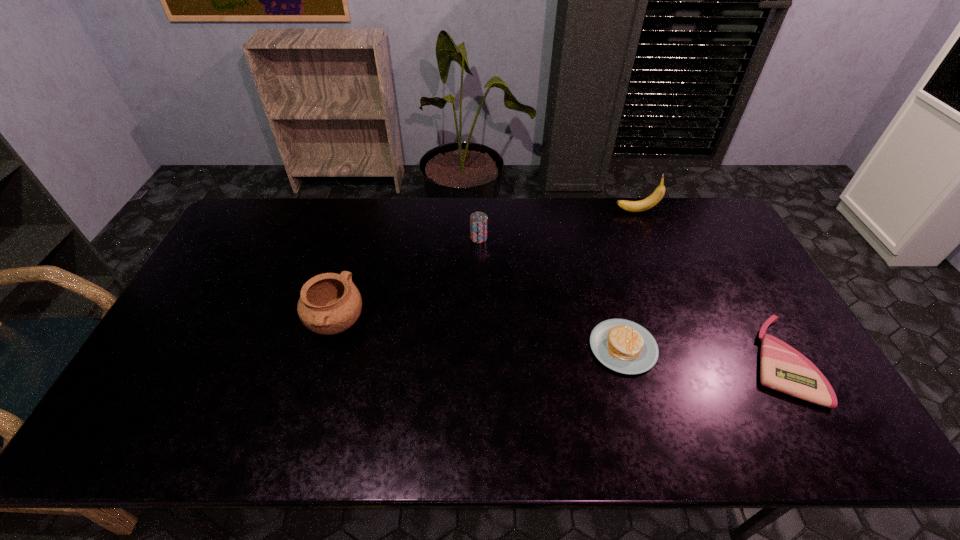
Find the location of a particular element. The height and width of the screenshot is (540, 960). banana is located at coordinates (632, 206).

Identify the location of the fourth object from left to right. (632, 206).

Where is `the leftmost object`? This screenshot has height=540, width=960. the leftmost object is located at coordinates (329, 303).

This screenshot has width=960, height=540. Identify the location of the third tallest object. (478, 221).

Find the location of `the fourth object from right to left`. the fourth object from right to left is located at coordinates (478, 221).

The height and width of the screenshot is (540, 960). What are the coordinates of `pancake` in the screenshot? It's located at (623, 346).

I want to click on the third object from left to right, so click(x=623, y=346).

You are a GUI agent. You are given a task and a screenshot of the screen. Output one action in this format:
    pyautogui.click(x=<x>, y=<y>)
    Task: Click on the wristlet
    Image resolution: width=960 pixels, height=540 pixels.
    Given the screenshot: What is the action you would take?
    pyautogui.click(x=782, y=368)

Locate an element on the screen. The width and height of the screenshot is (960, 540). the shortest object is located at coordinates (782, 368).

What are the coordinates of `vacant space located 0.330m at the start of the peel on the farthest object` in the screenshot? It's located at (525, 211).